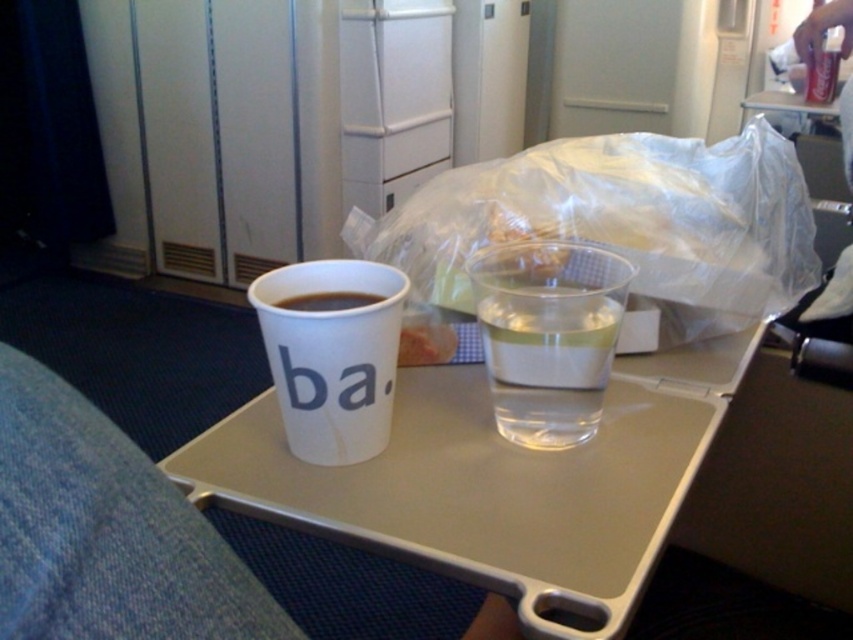
Is point (370, 326) positioned after point (357, 301)?

No, (370, 326) is in front of (357, 301).

Who is higher up, white paper cup at center or matte white cup at center?

matte white cup at center

The width and height of the screenshot is (853, 640). Find the location of `white paper cup at center`. white paper cup at center is located at coordinates (332, 356).

At what (x,y) coordinates should I click in order to perform the action: click on white paper cup at center. Please return your answer as a coordinate pair (x, y). Looking at the image, I should click on (332, 356).

Can you confirm if clear plastic cup at center is positioned above matte white cup at center?

Incorrect, clear plastic cup at center is not positioned above matte white cup at center.

Between point (480, 284) and point (321, 305), which one is positioned in front?

Point (321, 305) is more forward.

Is point (492, 342) positioned before point (310, 308)?

No, (492, 342) is further to viewer.

Locate an element on the screen. clear plastic cup at center is located at coordinates (548, 337).

Is white paper cup at upper center above white paper cup at center?

Actually, white paper cup at upper center is below white paper cup at center.

The width and height of the screenshot is (853, 640). Describe the element at coordinates (106, 531) in the screenshot. I see `white paper cup at upper center` at that location.

The image size is (853, 640). I want to click on white paper cup at upper center, so click(106, 531).